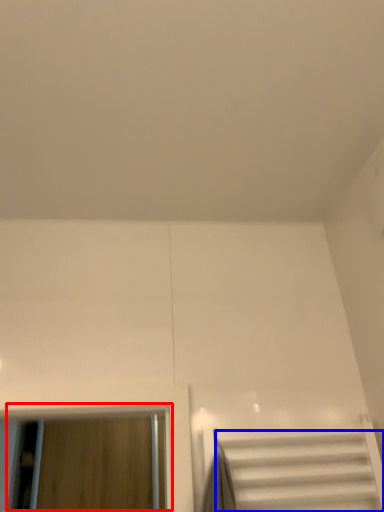
Question: Among these objects, which one is farthest to the camera, window (highlighted by a red box) or stairs (highlighted by a blue box)?

Choices:
 (A) window
 (B) stairs

Answer: (A)